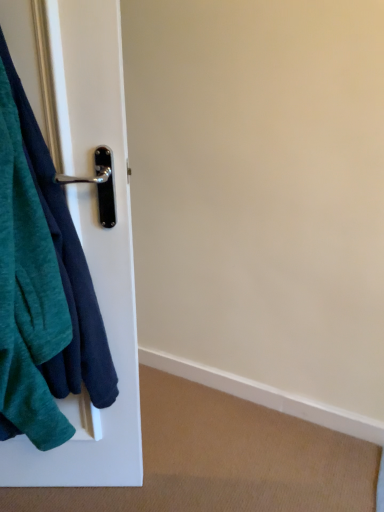
Identify the location of white glossy door handle at left. click(x=92, y=250).

In order to face white glossy door handle at left, should I rotate leftwards or rightwards?

Turn left by 19.332 degrees to look at white glossy door handle at left.

The height and width of the screenshot is (512, 384). Describe the element at coordinates (92, 250) in the screenshot. I see `white glossy door handle at left` at that location.

This screenshot has width=384, height=512. In order to click on white glossy door handle at left in this screenshot , I will do `click(92, 250)`.